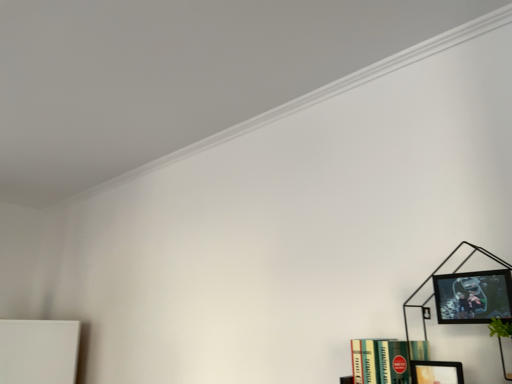
Question: Is black matte bookcase at right not within matte black picture frame at lower right, which is the second picture frame from top to bottom?

Choices:
 (A) yes
 (B) no

Answer: (A)

Question: Does black matte bookcase at right have a larger size compared to matte black picture frame at lower right, which is the first picture frame from bottom to top?

Choices:
 (A) no
 (B) yes

Answer: (B)

Question: Does black matte bookcase at right have a lesser width compared to matte black picture frame at lower right, which is the second picture frame from top to bottom?

Choices:
 (A) no
 (B) yes

Answer: (A)

Question: Is black matte bookcase at right closer to camera compared to matte black picture frame at lower right, which is the second picture frame from top to bottom?

Choices:
 (A) no
 (B) yes

Answer: (B)

Question: Considering the relative sizes of black matte bookcase at right and matte black picture frame at lower right, which is the second picture frame from top to bottom, in the image provided, is black matte bookcase at right wider than matte black picture frame at lower right, which is the second picture frame from top to bottom,?

Choices:
 (A) yes
 (B) no

Answer: (A)

Question: Considering the relative positions of black matte bookcase at right and matte black picture frame at lower right, which is the first picture frame from bottom to top, in the image provided, is black matte bookcase at right behind matte black picture frame at lower right, which is the first picture frame from bottom to top,?

Choices:
 (A) no
 (B) yes

Answer: (A)

Question: Is matte black picture frame at lower right, which is the second picture frame from top to bottom, taller than matte black picture frame at upper right, the 1th picture frame in the top-to-bottom sequence?

Choices:
 (A) no
 (B) yes

Answer: (B)

Question: Does matte black picture frame at lower right, which is the first picture frame from bottom to top, have a larger size compared to matte black picture frame at upper right, the 1th picture frame in the top-to-bottom sequence?

Choices:
 (A) no
 (B) yes

Answer: (A)

Question: Is matte black picture frame at lower right, which is the second picture frame from top to bottom, placed right next to matte black picture frame at upper right, the 1th picture frame in the top-to-bottom sequence?

Choices:
 (A) yes
 (B) no

Answer: (B)

Question: From the image's perspective, is matte black picture frame at lower right, which is the first picture frame from bottom to top, under matte black picture frame at upper right, the 1th picture frame in the top-to-bottom sequence?

Choices:
 (A) yes
 (B) no

Answer: (A)

Question: Does matte black picture frame at lower right, which is the first picture frame from bottom to top, have a smaller size compared to matte black picture frame at upper right, which is the 2th picture frame from bottom to top?

Choices:
 (A) yes
 (B) no

Answer: (A)

Question: From a real-world perspective, is matte black picture frame at lower right, which is the first picture frame from bottom to top, positioned under matte black picture frame at upper right, the 1th picture frame in the top-to-bottom sequence, based on gravity?

Choices:
 (A) yes
 (B) no

Answer: (A)

Question: Does matte black picture frame at lower right, which is the first picture frame from bottom to top, have a lesser width compared to green matte book at lower right?

Choices:
 (A) no
 (B) yes

Answer: (B)